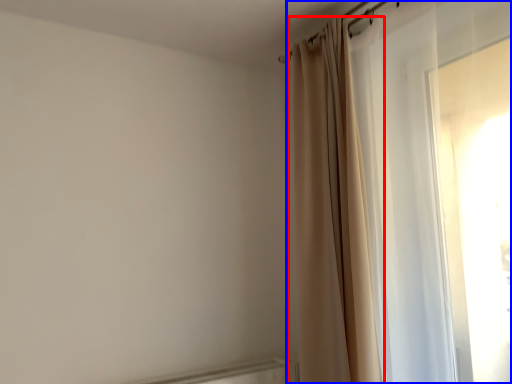
Question: Among these objects, which one is nearest to the camera, curtain (highlighted by a red box) or curtain (highlighted by a blue box)?

Choices:
 (A) curtain
 (B) curtain

Answer: (B)